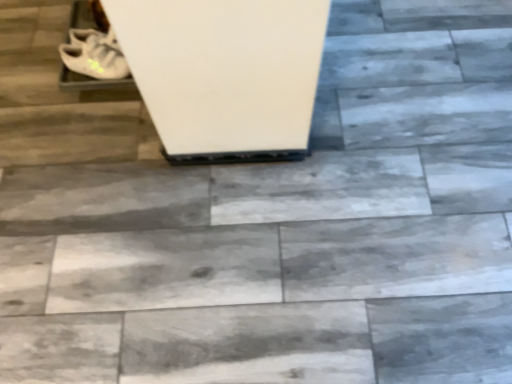
Question: Is white matte shoe at upper left aimed at white matte shoe at upper left?

Choices:
 (A) yes
 (B) no

Answer: (B)

Question: Is white matte shoe at upper left shorter than white matte shoe at upper left?

Choices:
 (A) yes
 (B) no

Answer: (B)

Question: Considering the relative sizes of white matte shoe at upper left and white matte shoe at upper left in the image provided, is white matte shoe at upper left bigger than white matte shoe at upper left?

Choices:
 (A) yes
 (B) no

Answer: (A)

Question: Is white matte shoe at upper left inside white matte shoe at upper left?

Choices:
 (A) yes
 (B) no

Answer: (B)

Question: Is white matte shoe at upper left smaller than white matte shoe at upper left?

Choices:
 (A) yes
 (B) no

Answer: (B)

Question: From the image's perspective, is white matte shoe at upper left over white matte shoe at upper left?

Choices:
 (A) no
 (B) yes

Answer: (B)

Question: Is white matte shoe at upper left further to the viewer compared to white matte shoe at upper left?

Choices:
 (A) no
 (B) yes

Answer: (A)

Question: Does white matte shoe at upper left have a smaller size compared to white matte shoe at upper left?

Choices:
 (A) no
 (B) yes

Answer: (B)

Question: Is white matte shoe at upper left wider than white matte shoe at upper left?

Choices:
 (A) yes
 (B) no

Answer: (A)

Question: From a real-world perspective, does white matte shoe at upper left sit lower than white matte shoe at upper left?

Choices:
 (A) no
 (B) yes

Answer: (B)

Question: Is white matte shoe at upper left with white matte shoe at upper left?

Choices:
 (A) no
 (B) yes

Answer: (B)

Question: Is white matte shoe at upper left turned away from white matte shoe at upper left?

Choices:
 (A) no
 (B) yes

Answer: (A)

Question: Is white matte shoe at upper left wider or thinner than white matte shoe at upper left?

Choices:
 (A) thin
 (B) wide

Answer: (A)